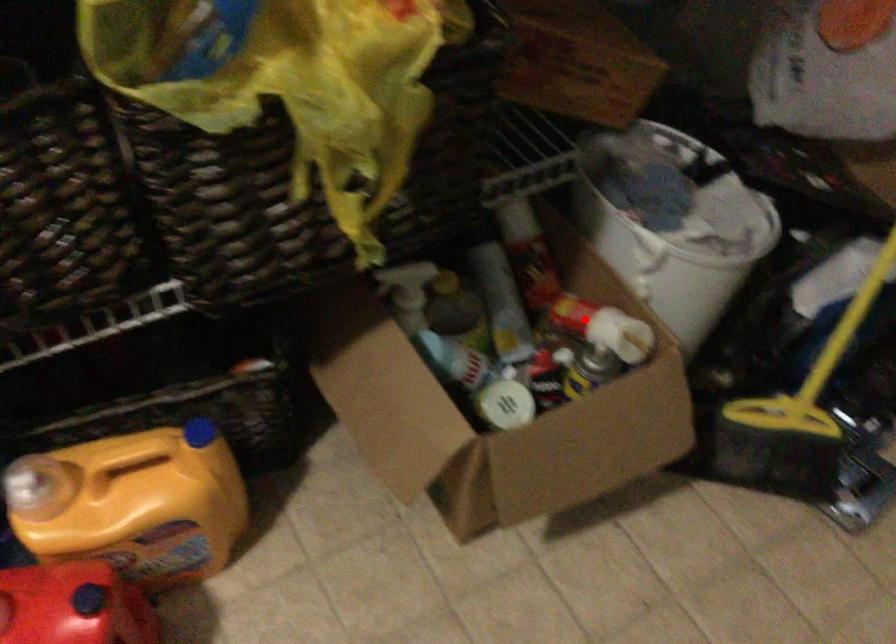
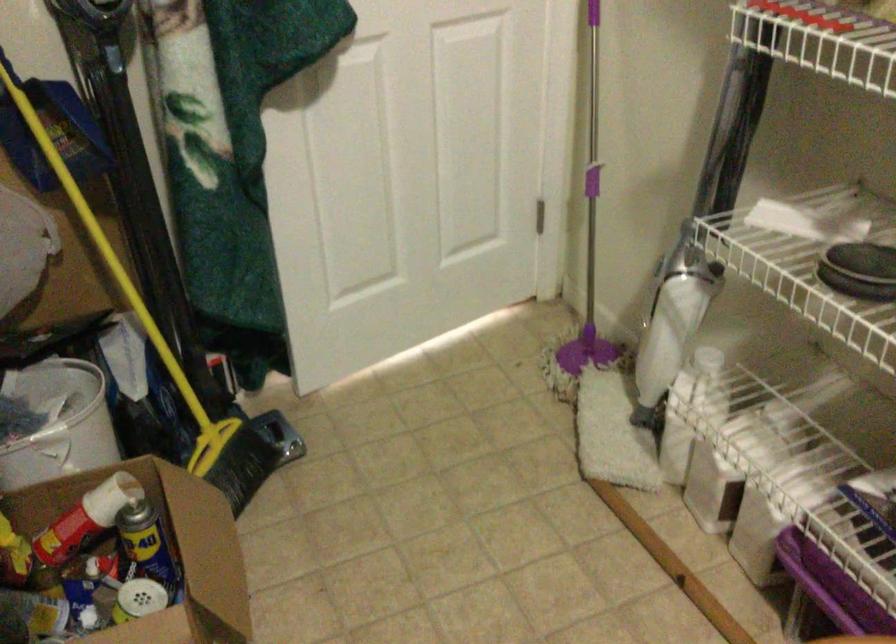
Find the pixel in the second image that matches the highlighted location in the first image.

(85, 518)